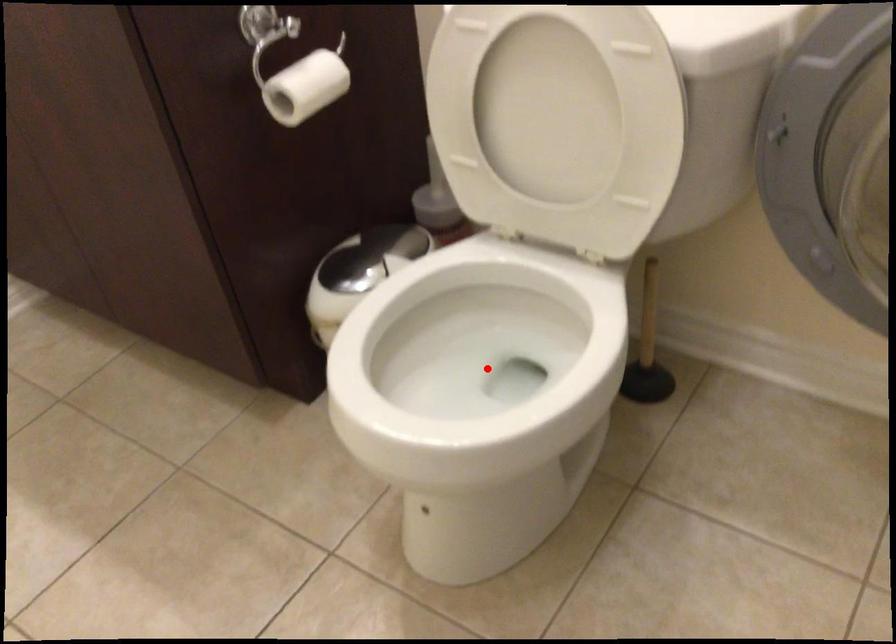
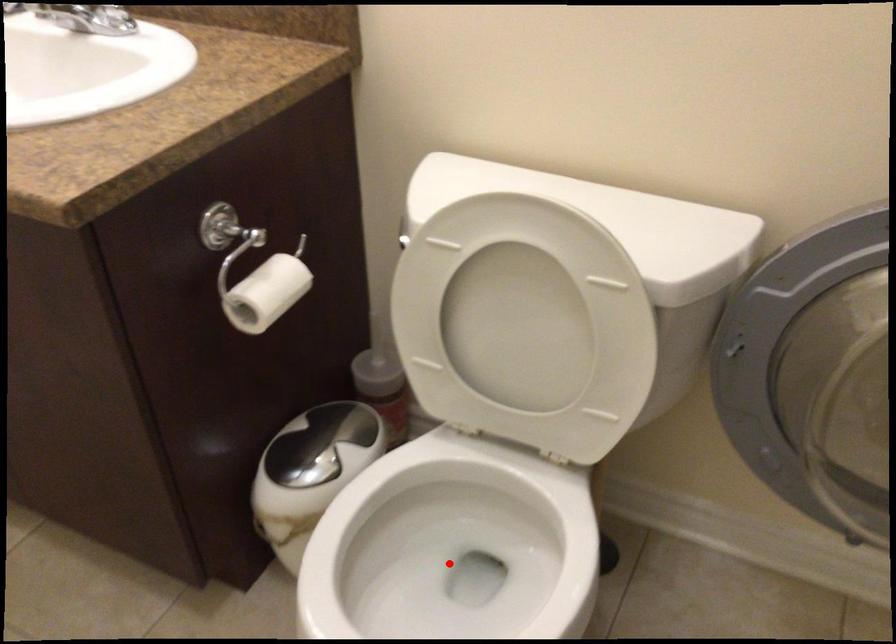
I am providing you with two images of the same scene from different viewpoints. A red point is marked on the first image and another point is marked on the second image. Is the red point in image1 aligned with the point shown in image2?

Yes